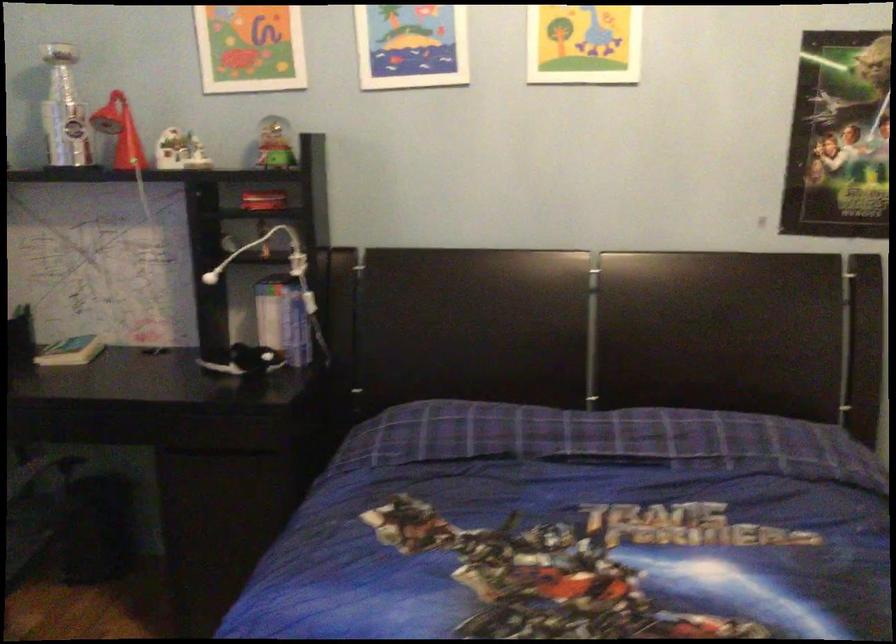
Find the location of `glass snow globe`. glass snow globe is located at coordinates (273, 144).